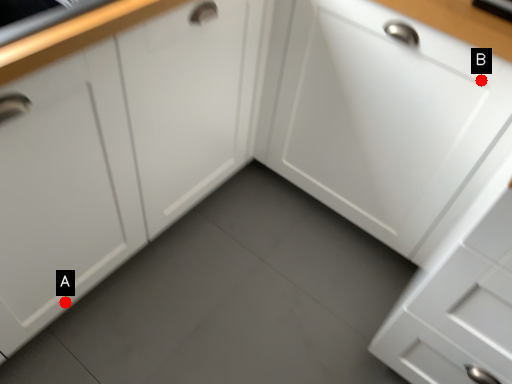
Question: Two points are circled on the image, labeled by A and B beside each circle. Which point is closer to the camera taking this photo?

Choices:
 (A) A is closer
 (B) B is closer

Answer: (B)